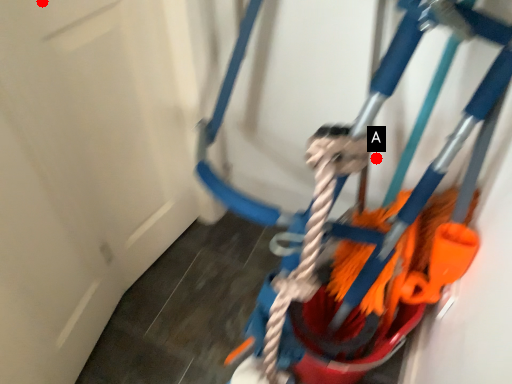
Question: Two points are circled on the image, labeled by A and B beside each circle. Which point is closer to the camera?

Choices:
 (A) A is closer
 (B) B is closer

Answer: (B)